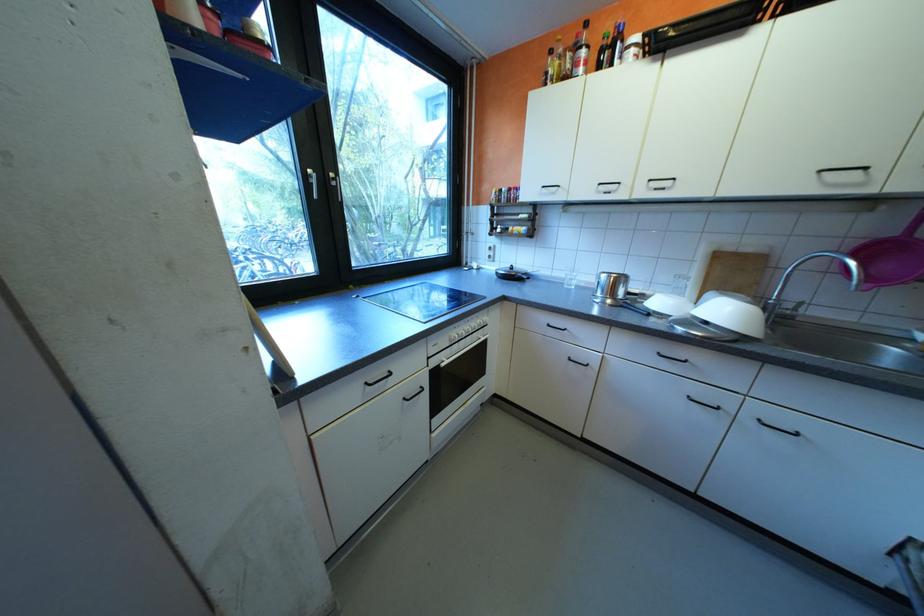
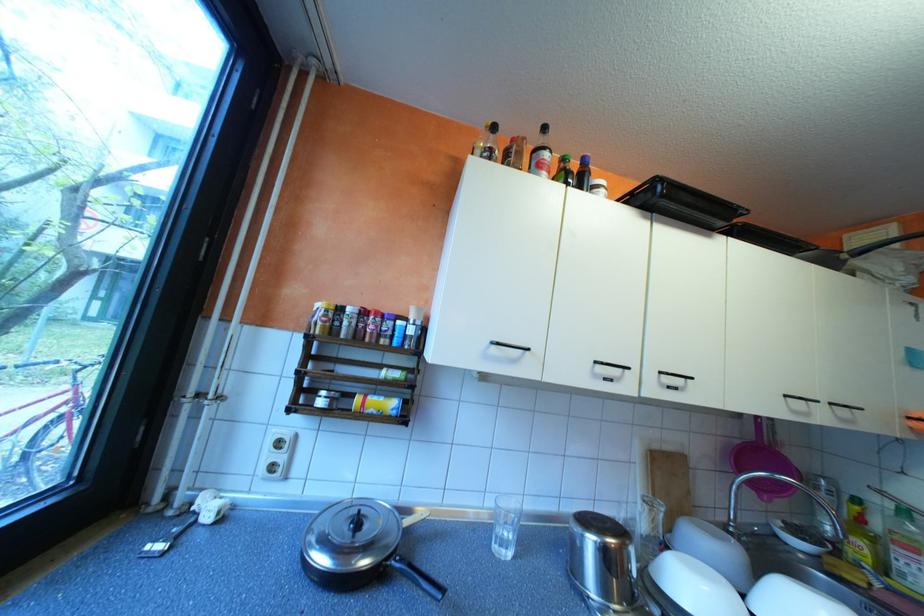
Where in the second image is the point corresponding to pixel 788 300 from the first image?

(747, 525)